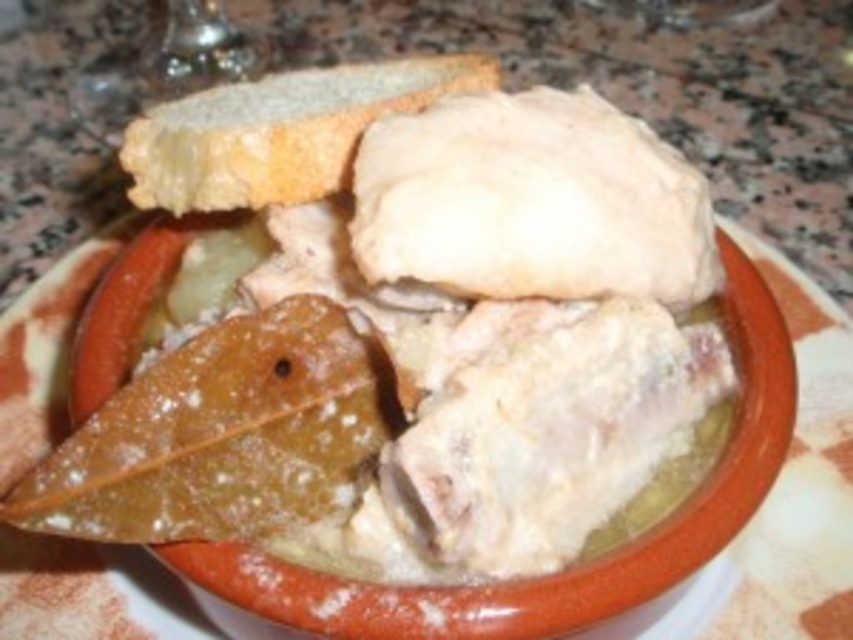
Is white matte leaf at upper left smaller than spongy white bread at upper center?

No, white matte leaf at upper left is not smaller than spongy white bread at upper center.

Between point (502, 102) and point (225, 161), which one is positioned behind?

Point (502, 102)

The width and height of the screenshot is (853, 640). Identify the location of white matte leaf at upper left. (422, 356).